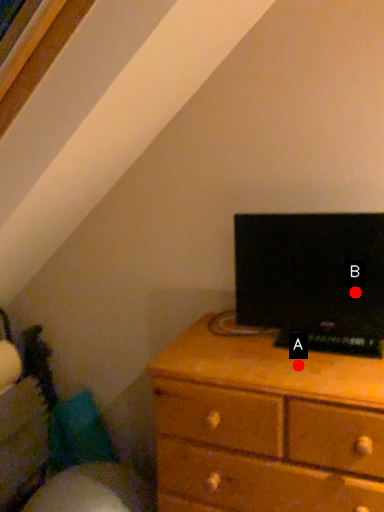
Question: Two points are circled on the image, labeled by A and B beside each circle. Which point is closer to the camera?

Choices:
 (A) A is closer
 (B) B is closer

Answer: (A)